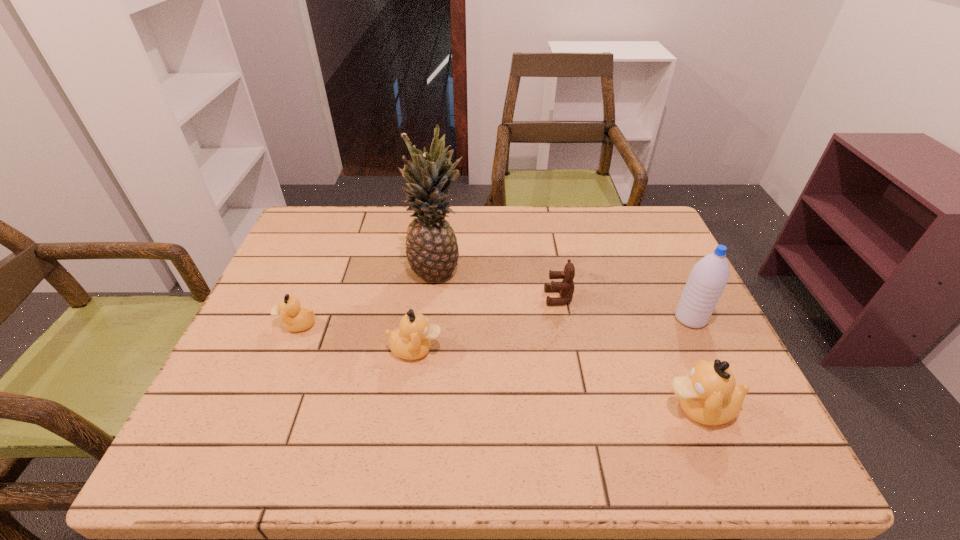
Locate an element on the screen. Image resolution: width=960 pixels, height=540 pixels. vacant position for inserting another duckling evenly is located at coordinates (549, 377).